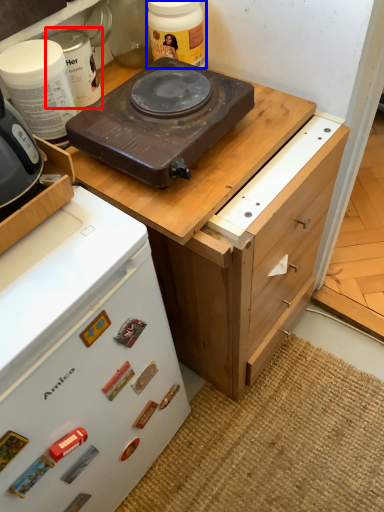
Question: Among these objects, which one is farthest to the camera, kitchen appliance (highlighted by a red box) or kitchen appliance (highlighted by a blue box)?

Choices:
 (A) kitchen appliance
 (B) kitchen appliance

Answer: (B)